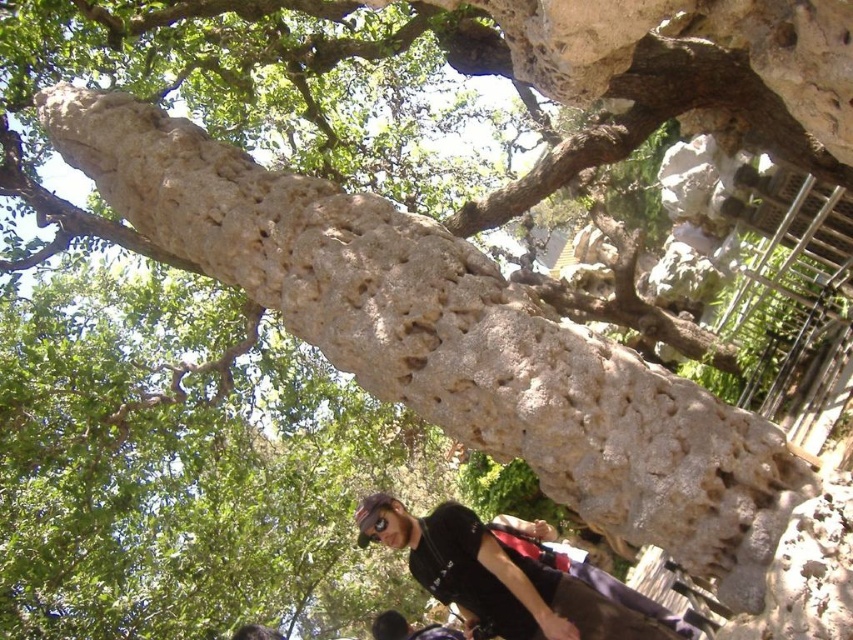
Question: In this image, where is black matte skateboarder at center located relative to matte black goggles at center?

Choices:
 (A) below
 (B) above

Answer: (A)

Question: Which of the following is the farthest from the observer?

Choices:
 (A) (543, 595)
 (B) (375, 518)

Answer: (B)

Question: Is the position of black matte skateboarder at center more distant than that of matte black goggles at center?

Choices:
 (A) yes
 (B) no

Answer: (B)

Question: Is black matte skateboarder at center wider than matte black goggles at center?

Choices:
 (A) no
 (B) yes

Answer: (B)